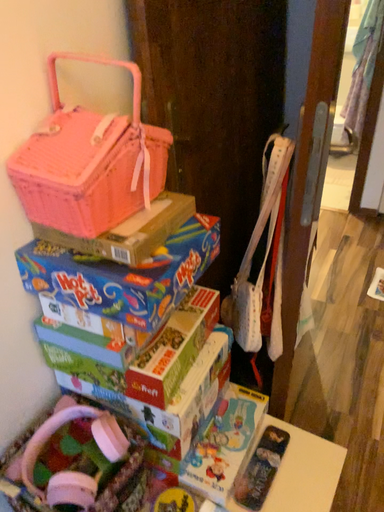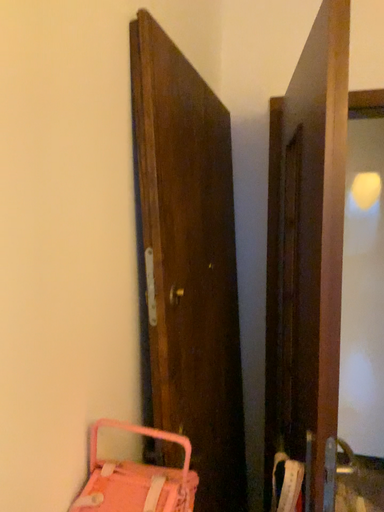
Question: Which way did the camera rotate in the video?

Choices:
 (A) rotated downward
 (B) rotated upward

Answer: (B)